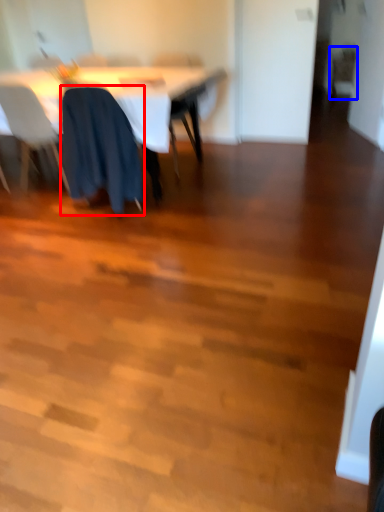
Question: Which point is closer to the camera, chair (highlighted by a red box) or chair (highlighted by a blue box)?

Choices:
 (A) chair
 (B) chair

Answer: (A)